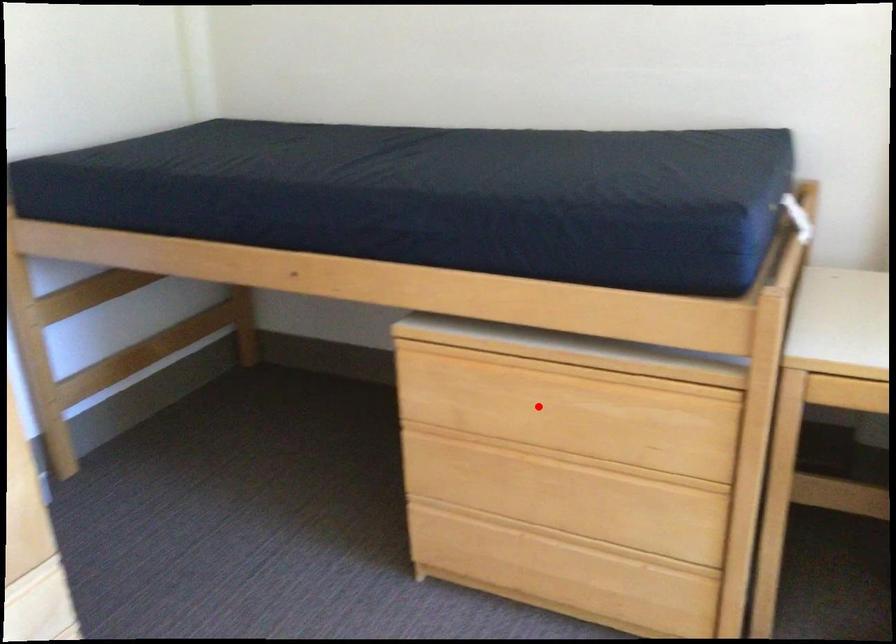
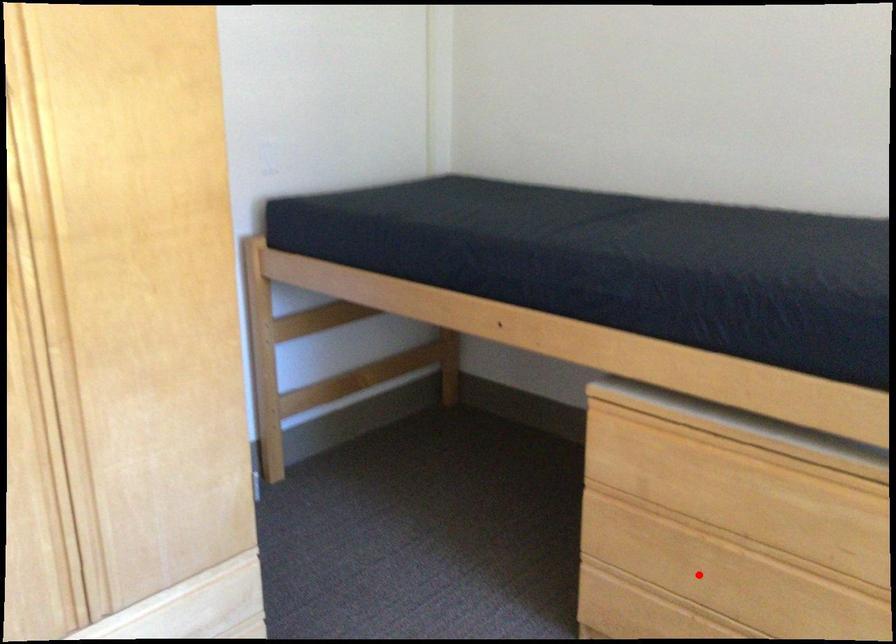
I am providing you with two images of the same scene from different viewpoints. A red point is marked on the first image and another point is marked on the second image. Are the points marked in image1 and image2 representing the same 3D position?

No